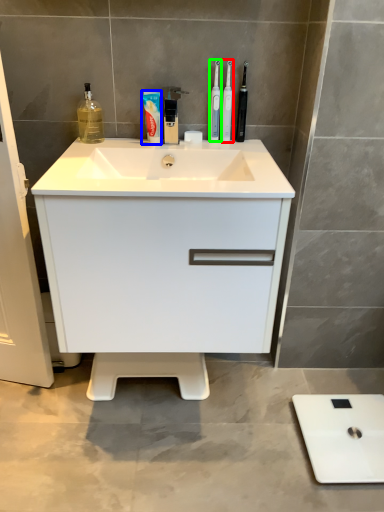
Question: Based on their relative distances, which object is nearer to toothbrush (highlighted by a red box)? Choose from toothpaste (highlighted by a blue box) and toothbrush (highlighted by a green box).

Choices:
 (A) toothpaste
 (B) toothbrush

Answer: (B)